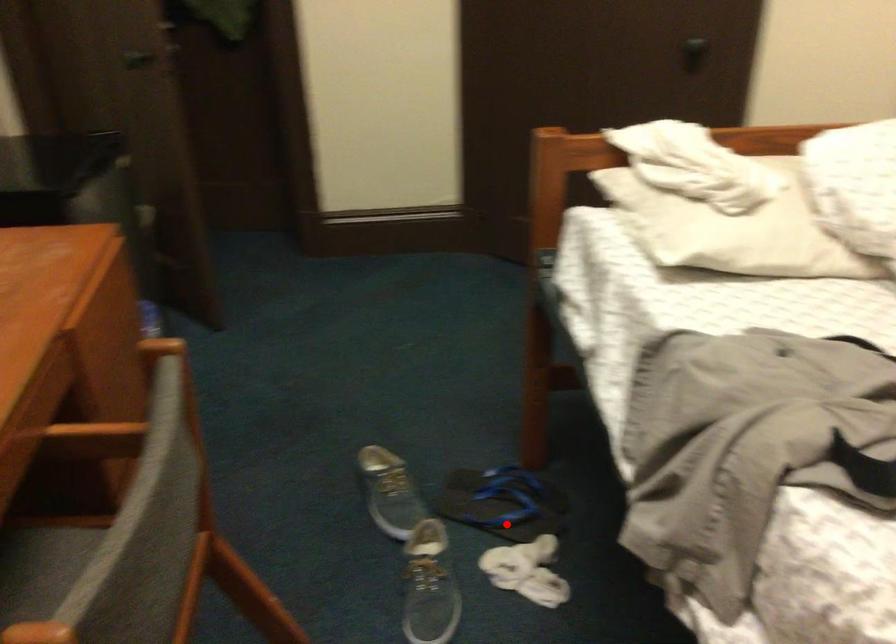
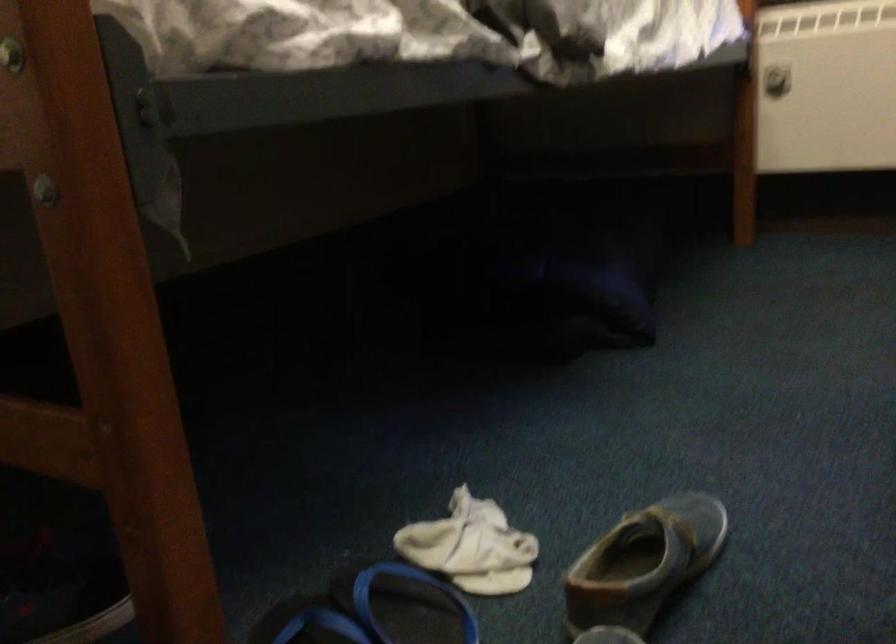
Locate, in the second image, the point that corresponds to the highlighted location in the first image.

(406, 605)